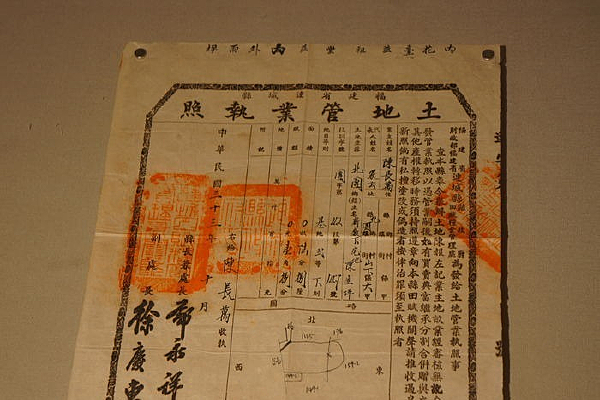
This screenshot has height=400, width=600. Identify the location of desktop. (528, 111), (24, 51).